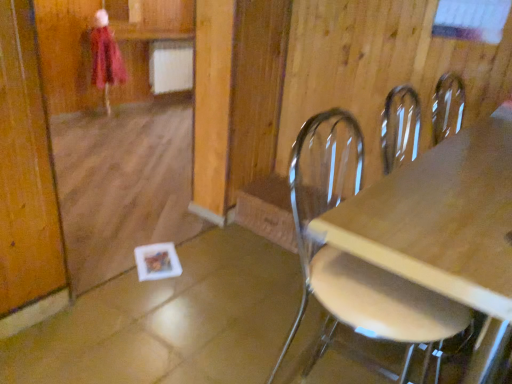
Question: From a real-world perspective, is metallic silver chair at right positioned above or below matte pink coat at upper left?

Choices:
 (A) below
 (B) above

Answer: (B)

Question: Is metallic silver chair at right taller or shorter than matte pink coat at upper left?

Choices:
 (A) short
 (B) tall

Answer: (B)

Question: Is point (345, 258) positioned closer to the camera than point (118, 49)?

Choices:
 (A) farther
 (B) closer

Answer: (B)

Question: Is matte pink coat at upper left spatially inside metallic silver chair at right, or outside of it?

Choices:
 (A) outside
 (B) inside

Answer: (A)

Question: Relative to metallic silver chair at right, is matte pink coat at upper left in front or behind?

Choices:
 (A) behind
 (B) front

Answer: (A)

Question: In terms of width, does matte pink coat at upper left look wider or thinner when compared to metallic silver chair at right?

Choices:
 (A) wide
 (B) thin

Answer: (B)

Question: From their relative heights in the image, would you say matte pink coat at upper left is taller or shorter than metallic silver chair at right?

Choices:
 (A) tall
 (B) short

Answer: (B)